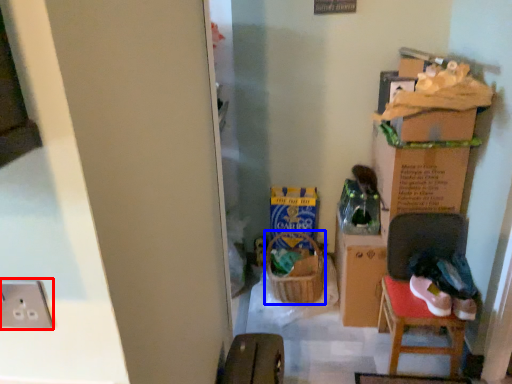
Question: Among these objects, which one is nearest to the camera, electric outlet (highlighted by a red box) or laundry basket (highlighted by a blue box)?

Choices:
 (A) electric outlet
 (B) laundry basket

Answer: (A)